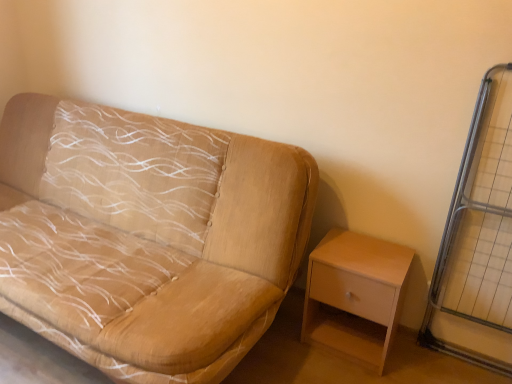
The height and width of the screenshot is (384, 512). Find the location of `free space between light wood/wooden nightstand at lower right and metal grid at right`. free space between light wood/wooden nightstand at lower right and metal grid at right is located at coordinates (426, 367).